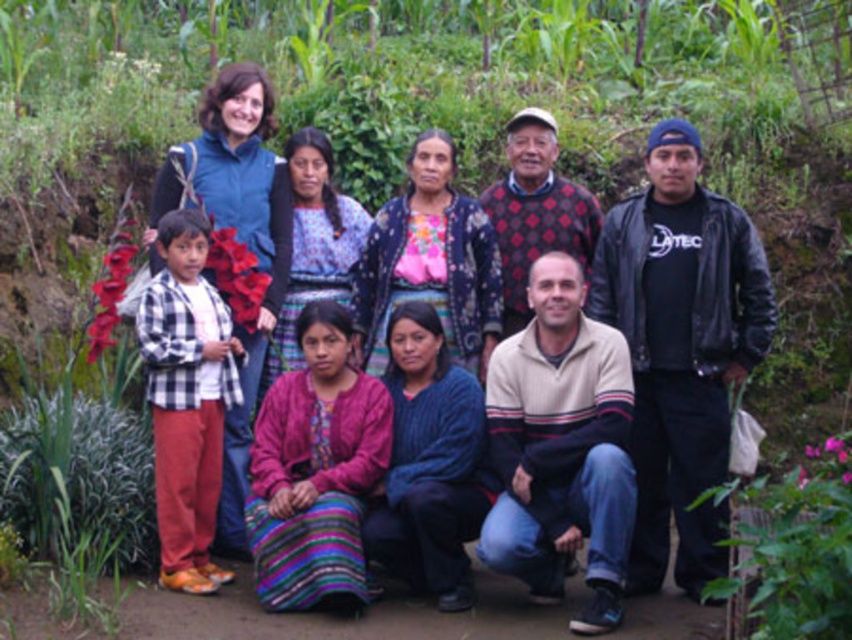
You are a photographer trying to capture a photo of the group. You want to ensure that both the multicolored woven skirt at center and the black leather jacket at right are clearly visible in the frame. Based on their positions, which object is closer to the left side of the photo?

The multicolored woven skirt at center is to the left of the black leather jacket at right, so the multicolored woven skirt at center is closer to the left side of the photo.

You are organizing a photo shoot and need to ensure that the black leather jacket at right and the knitted sweater at center are visible in the final image. Based on their sizes, which one might require more careful framing to ensure it doesn not get lost in the background?

The black leather jacket at right occupies less space than the knitted sweater at center, so it might require more careful framing to ensure it doesn not get lost in the background.